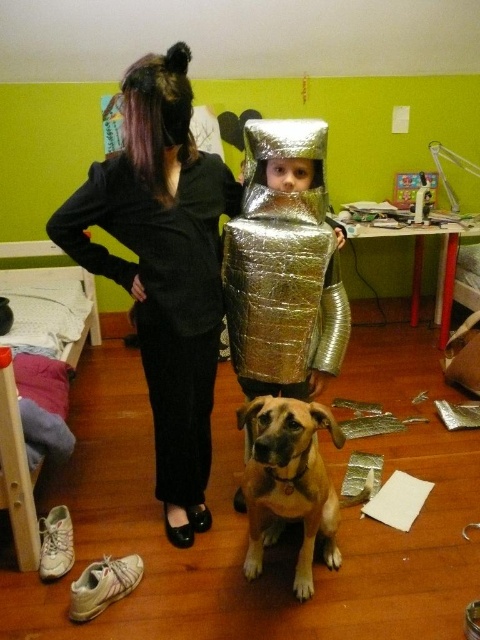
Question: Can you confirm if black fabric pants at center is positioned above golden-brown fur dog at center?

Choices:
 (A) no
 (B) yes

Answer: (B)

Question: Is black fabric pants at center further to camera compared to golden-brown fur dog at center?

Choices:
 (A) yes
 (B) no

Answer: (A)

Question: Which point is closer to the camera taking this photo?

Choices:
 (A) (149, 131)
 (B) (325, 563)

Answer: (A)

Question: Which point is farther to the camera?

Choices:
 (A) (305, 429)
 (B) (195, 508)

Answer: (B)

Question: Is black fabric pants at center smaller than golden-brown fur dog at center?

Choices:
 (A) no
 (B) yes

Answer: (A)